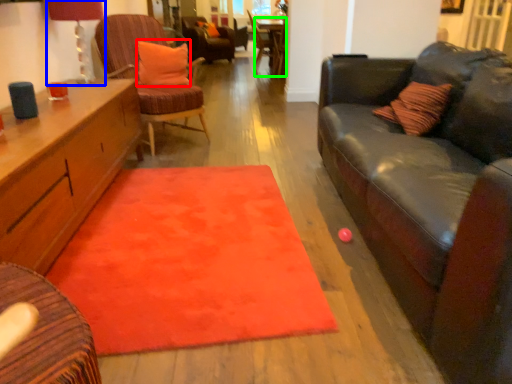
Question: Which is farther away from pillow (highlighted by a red box)? lamp (highlighted by a blue box) or table (highlighted by a green box)?

Choices:
 (A) lamp
 (B) table

Answer: (B)